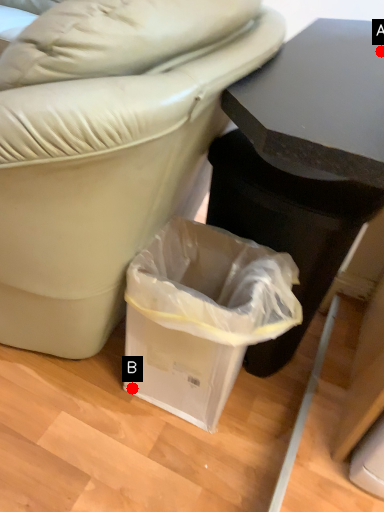
Question: Two points are circled on the image, labeled by A and B beside each circle. Which point is farther from the camera taking this photo?

Choices:
 (A) A is further
 (B) B is further

Answer: (B)